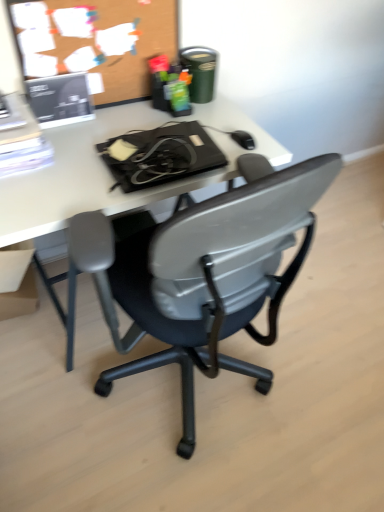
This screenshot has width=384, height=512. I want to click on vacant point above white plastic desk at center (from a real-world perspective), so click(x=97, y=158).